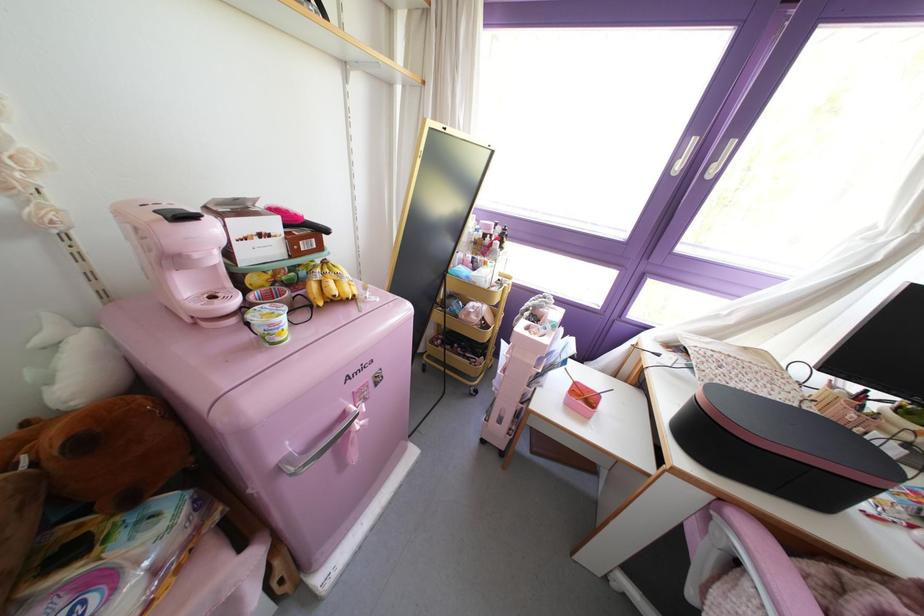
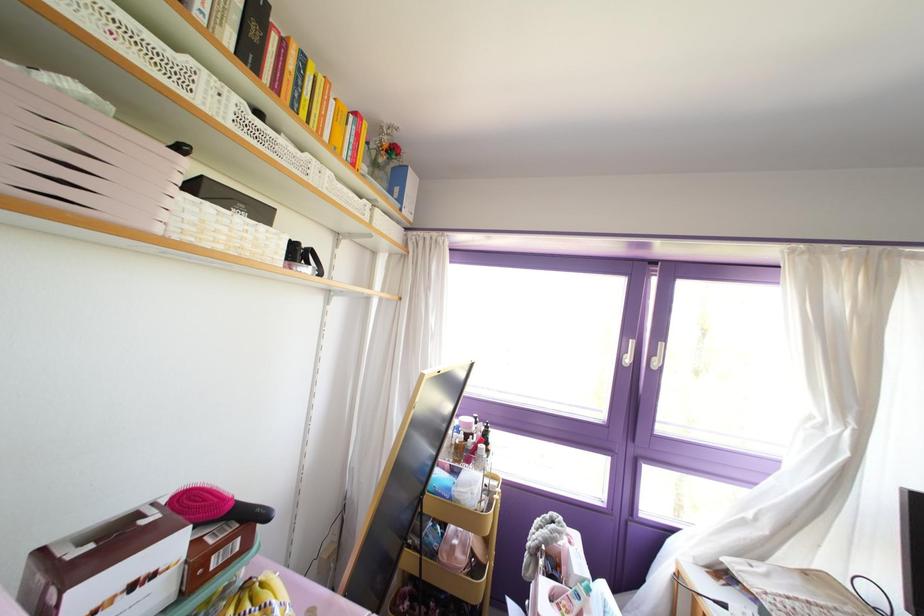
Question: The first image is from the beginning of the video and the second image is from the end. How did the camera likely rotate when shooting the video?

Choices:
 (A) Left
 (B) Right
 (C) Up
 (D) Down

Answer: (C)